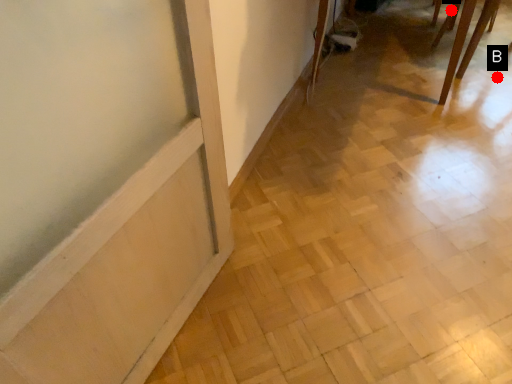
Question: Two points are circled on the image, labeled by A and B beside each circle. Which point is farther from the camera taking this photo?

Choices:
 (A) A is further
 (B) B is further

Answer: (A)